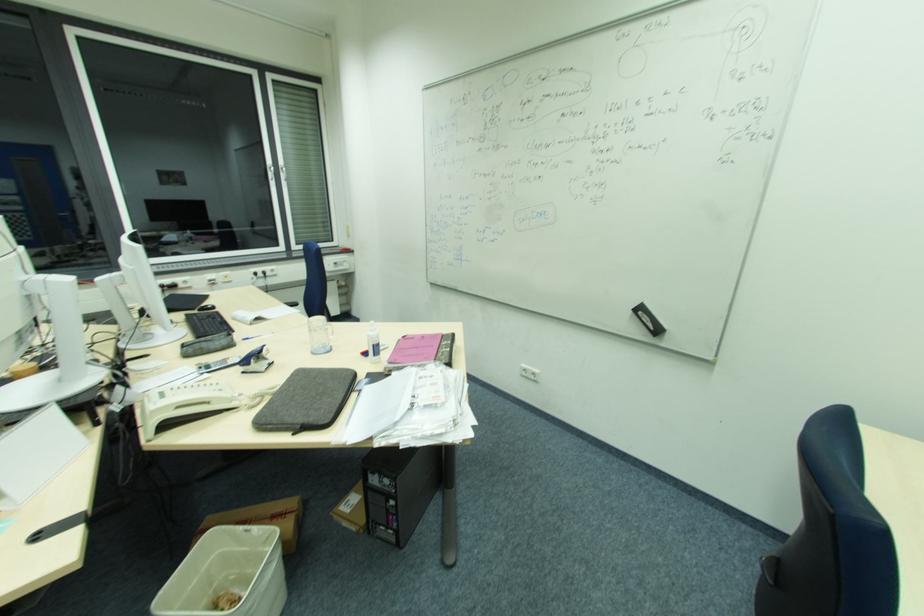
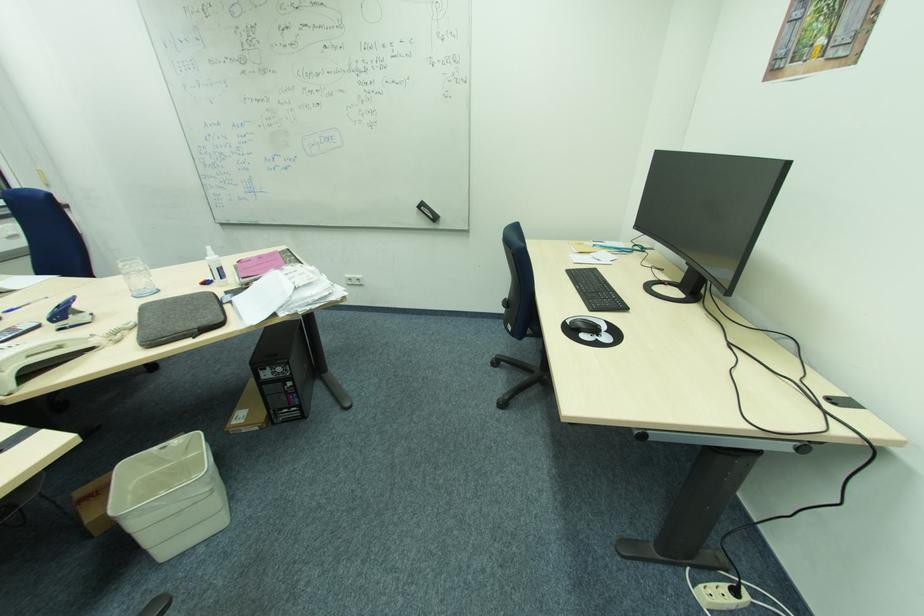
Where in the second image is the point corresponding to point (330, 351) from the first image?

(157, 292)